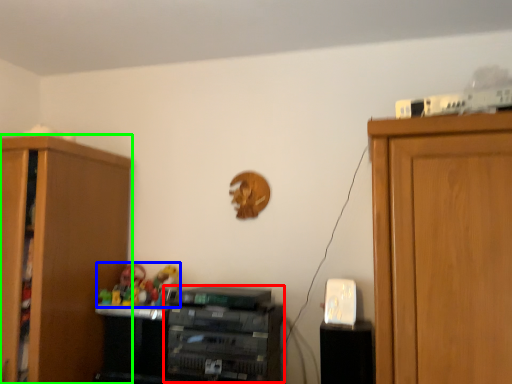
Question: Which is nearer to the cabinetry (highlighted by a red box)? toy (highlighted by a blue box) or cabinetry (highlighted by a green box).

Choices:
 (A) toy
 (B) cabinetry

Answer: (A)